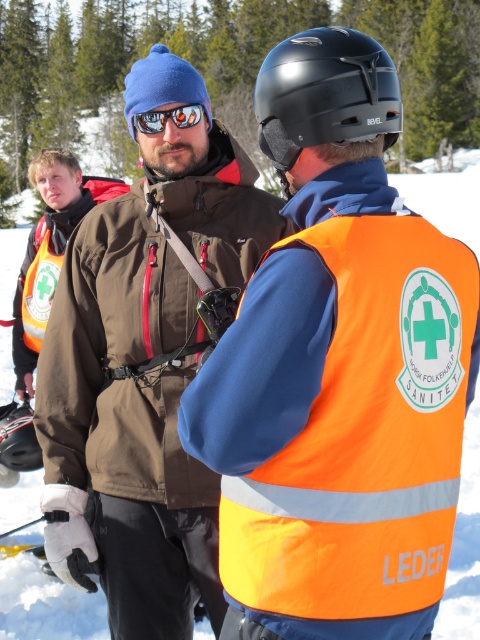
Question: Is black matte helmet at center further to the viewer compared to matte orange goggles at center?

Choices:
 (A) yes
 (B) no

Answer: (B)

Question: Does black matte helmet at center lie behind matte orange goggles at center?

Choices:
 (A) yes
 (B) no

Answer: (B)

Question: Which point appears farthest from the camera in this image?

Choices:
 (A) (280, 172)
 (B) (31, 314)
 (C) (108, 278)
 (D) (363, 467)

Answer: (B)

Question: Based on their relative distances, which object is nearer to the black matte helmet at center?

Choices:
 (A) orange reflective safety vest at center
 (B) orange reflective safety vest at left

Answer: (A)

Question: Does black matte helmet at center come in front of orange reflective safety vest at left?

Choices:
 (A) no
 (B) yes

Answer: (B)

Question: Among these objects, which one is farthest from the camera?

Choices:
 (A) orange reflective safety vest at center
 (B) orange reflective safety vest at left
 (C) matte brown jacket at center

Answer: (B)